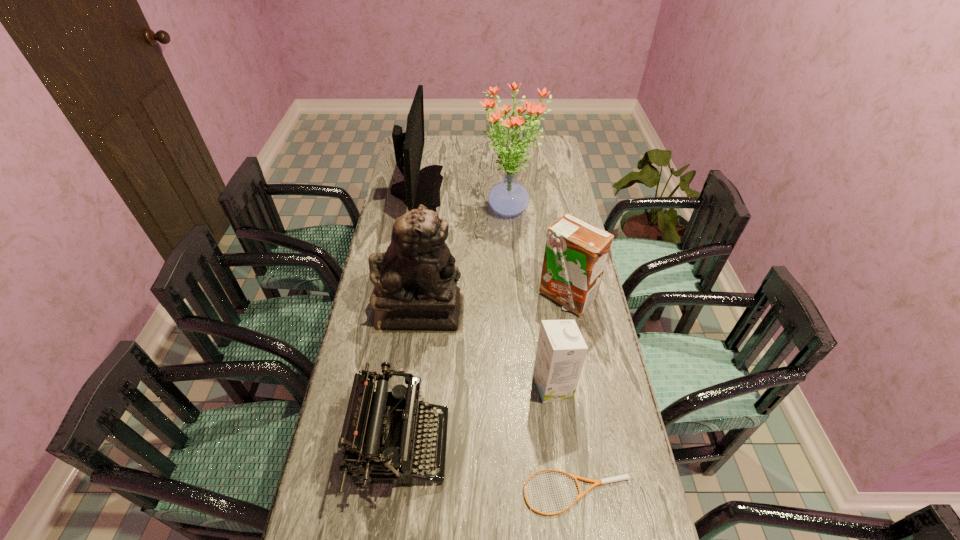
Locate an element on the screen. This screenshot has width=960, height=540. the tallest object is located at coordinates (508, 198).

Locate an element on the screen. The height and width of the screenshot is (540, 960). sculpture is located at coordinates (415, 281).

Locate an element on the screen. monitor is located at coordinates (423, 186).

The image size is (960, 540). I want to click on the farther carton, so click(576, 252).

What are the coordinates of `the nearer carton` in the screenshot? It's located at (561, 350).

The height and width of the screenshot is (540, 960). Find the location of `the sixth tallest object`. the sixth tallest object is located at coordinates [x=395, y=414].

The width and height of the screenshot is (960, 540). What are the coordinates of `tennis racket` in the screenshot? It's located at (621, 477).

Find the location of a particular element. This screenshot has height=540, width=960. free space located 0.260m on the front of the tallest object is located at coordinates (516, 278).

Locate an element on the screen. The width and height of the screenshot is (960, 540). vacant region located 0.280m on the front-facing side of the sculpture is located at coordinates (548, 310).

The image size is (960, 540). I want to click on free region located on the screen side of the monitor, so click(x=510, y=191).